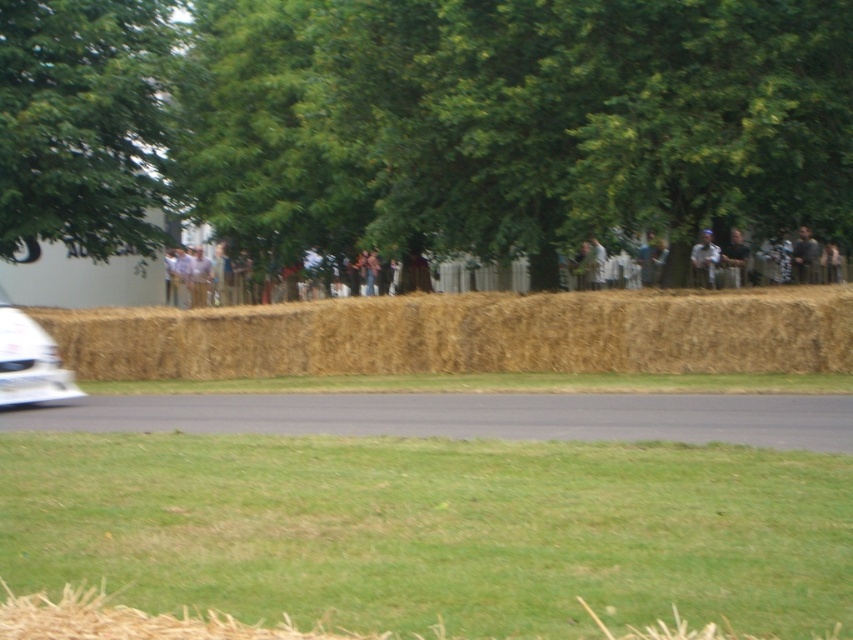
You are standing at the hay bale barrier in the foreground of the scene. If you want to reach the black asphalt road at center, which direction should you move in relation to the white fence behind which the crowd is gathered?

The black asphalt road at center is located at point coordinates, so you should move towards the center of the image, away from the white fence where the crowd is gathered, to reach it.

You are a photographer trying to capture a wide shot of the crowd behind the white fence. You notice the brown straw bales at center and the dark brown leather jacket at upper right in your frame. Since you want to focus on the crowd, which object should you adjust your camera to exclude?

The brown straw bales at center should be excluded because its width is larger than the dark brown leather jacket at upper right, making it more prominent in the frame and potentially obstructing the view of the crowd.

You are a photographer standing at the edge of the grassy area, wanting to capture a photo of the dark brown leather jacket at upper right without the brown straw bales at center blocking the view. Is this possible?

The brown straw bales at center are closer to the viewer than the dark brown leather jacket at upper right, so moving closer or adjusting your angle might allow you to frame the shot without the bales obstructing the jacket.